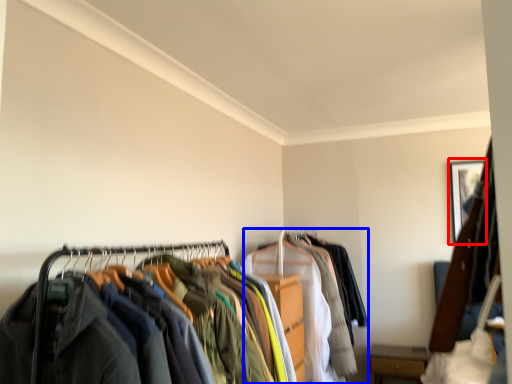
Question: Which object appears closest to the camera in this image, picture frame (highlighted by a red box) or garment (highlighted by a blue box)?

Choices:
 (A) picture frame
 (B) garment

Answer: (B)